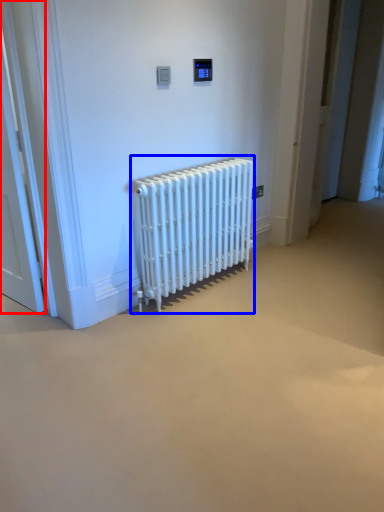
Question: Which point is further to the camera, door (highlighted by a red box) or radiator (highlighted by a blue box)?

Choices:
 (A) door
 (B) radiator

Answer: (B)